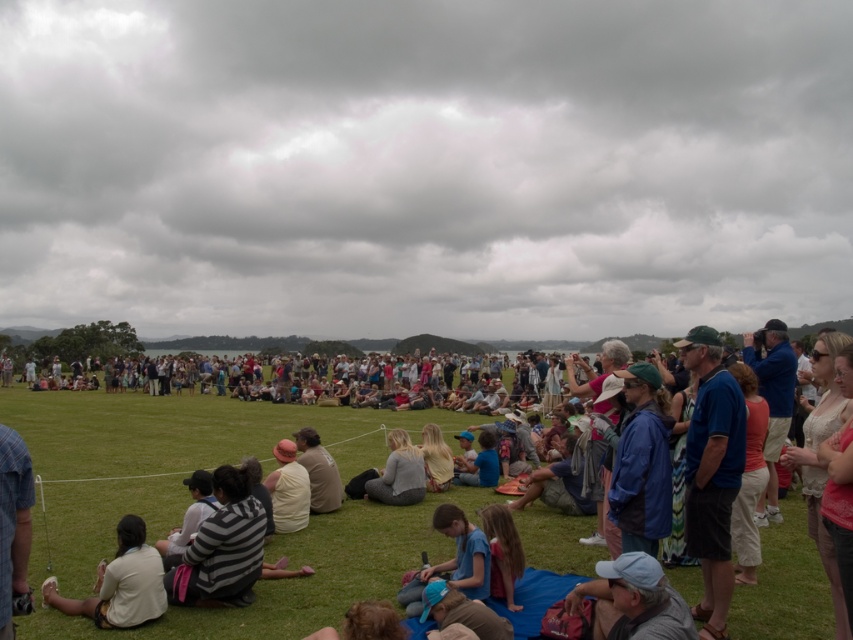
Question: Can you confirm if white casual clothing at center is positioned above striped sweater at center?

Choices:
 (A) yes
 (B) no

Answer: (B)

Question: Which of the following is the closest to the observer?

Choices:
 (A) (96, 570)
 (B) (511, 557)
 (C) (242, 477)

Answer: (B)

Question: Among these objects, which one is nearest to the camera?

Choices:
 (A) white cotton shirt at center
 (B) light beige shirt at lower left
 (C) striped sweater at center
 (D) light blue fabric cap at lower center

Answer: (D)

Question: Estimate the real-world distances between objects in this image. Which object is closer to the brown cotton shirt at center?

Choices:
 (A) striped sweater at center
 (B) light blue fabric cap at lower center
 (C) white casual clothing at center
 (D) light brown hair at lower center

Answer: (A)

Question: Does light beige shirt at lower left appear on the left side of light brown hair at lower center?

Choices:
 (A) yes
 (B) no

Answer: (A)

Question: Does white cotton shirt at center appear on the left side of light beige shirt at lower left?

Choices:
 (A) no
 (B) yes

Answer: (B)